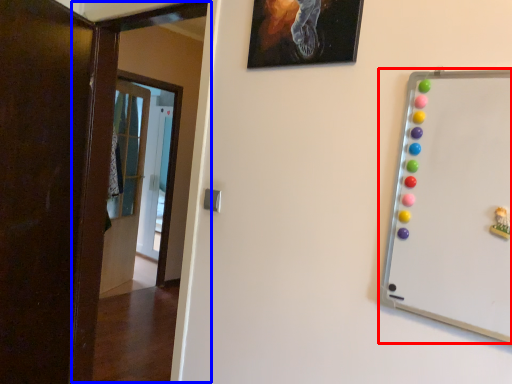
Question: Among these objects, which one is farthest to the camera, whiteboard (highlighted by a red box) or door (highlighted by a blue box)?

Choices:
 (A) whiteboard
 (B) door

Answer: (B)